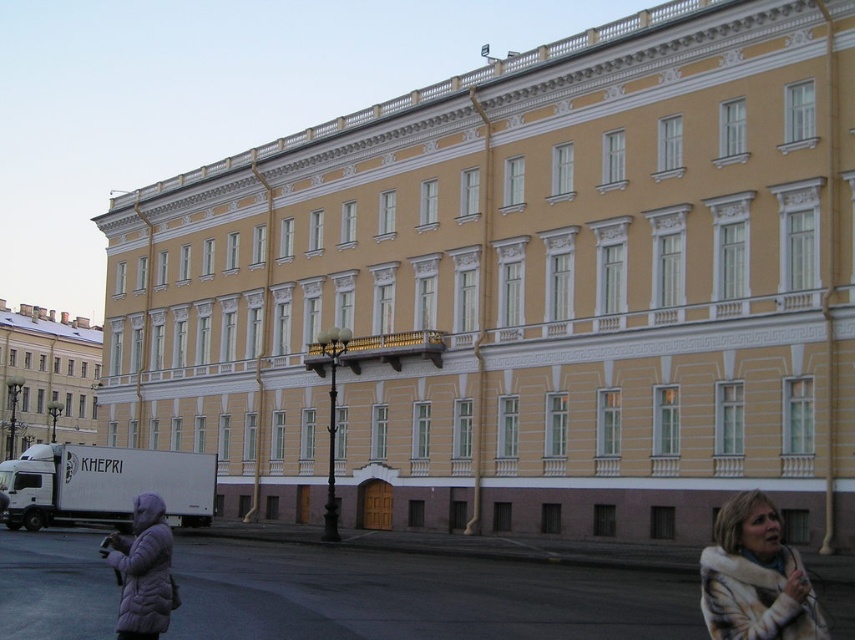
You are standing in front of the building and want to determine which of the two points, point (812, 612) or point (93, 346), is closer to you. Based on the image, which point is nearer?

Point (812, 612) is closer to the viewer than point (93, 346).